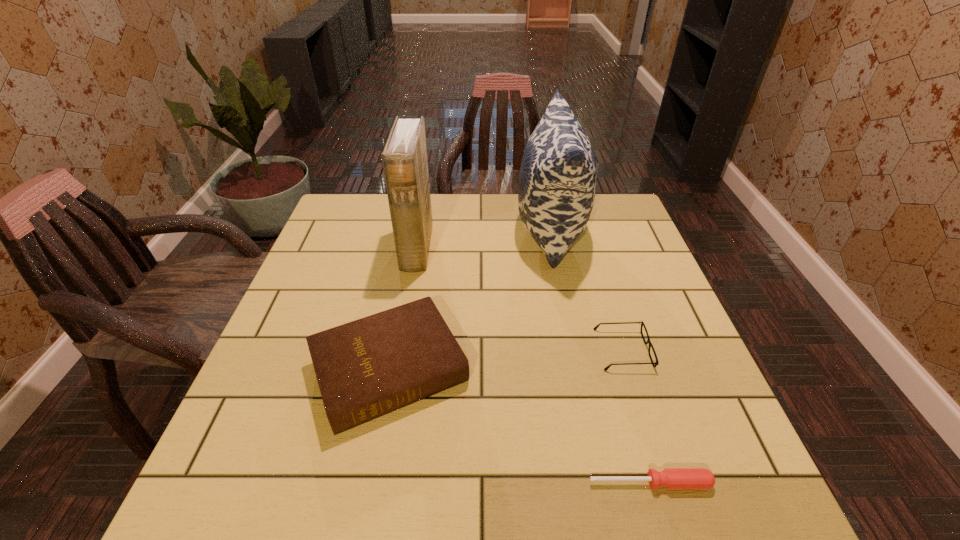
The width and height of the screenshot is (960, 540). I want to click on cushion, so tap(557, 182).

I want to click on phonebook, so click(404, 158).

This screenshot has height=540, width=960. I want to click on Bible, so click(x=367, y=368).

Where is `spectacles`? The image size is (960, 540). spectacles is located at coordinates (642, 323).

Where is `screwdriver`? screwdriver is located at coordinates (670, 478).

The width and height of the screenshot is (960, 540). I want to click on vacant space situated on the front surface of the cushion, so click(449, 231).

Locate an element on the screen. The image size is (960, 540). vacant space located on the front surface of the cushion is located at coordinates (466, 231).

At what (x,y) coordinates should I click in order to perform the action: click on vacant space located 0.190m on the front surface of the cushion. Please return your answer as a coordinate pair (x, y). This screenshot has width=960, height=540. Looking at the image, I should click on (453, 231).

What are the coordinates of `vacant space positioned on the cover of the phonebook` in the screenshot? It's located at click(486, 248).

Locate an element on the screen. This screenshot has width=960, height=540. free space located on the front of the Bible is located at coordinates (367, 492).